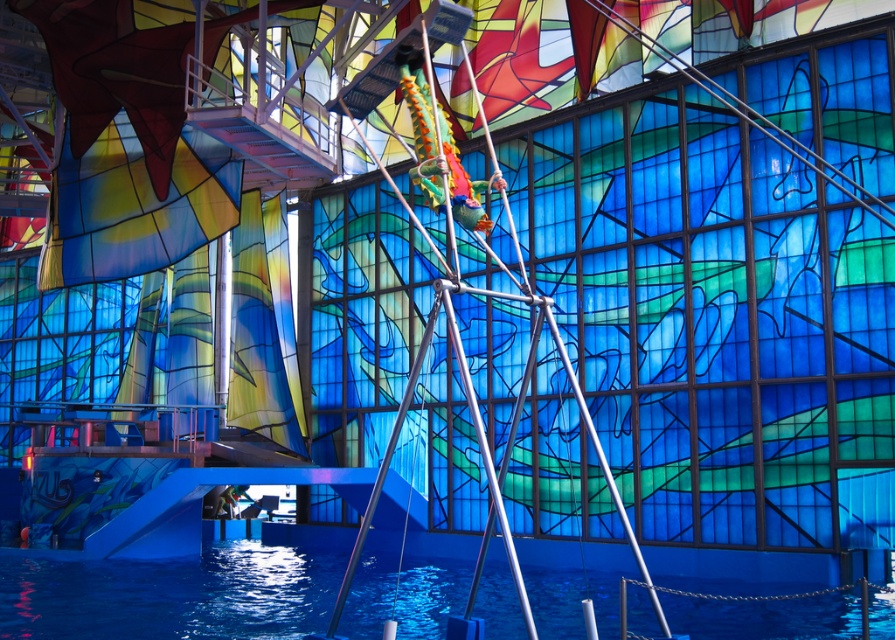
Which is below, blue smooth pool at lower center or metallic silver mast at center?

blue smooth pool at lower center is below.

Between point (92, 632) and point (484, 456), which one is positioned behind?

The point (92, 632) is more distant.

Image resolution: width=895 pixels, height=640 pixels. Identify the location of blue smooth pool at lower center. (171, 595).